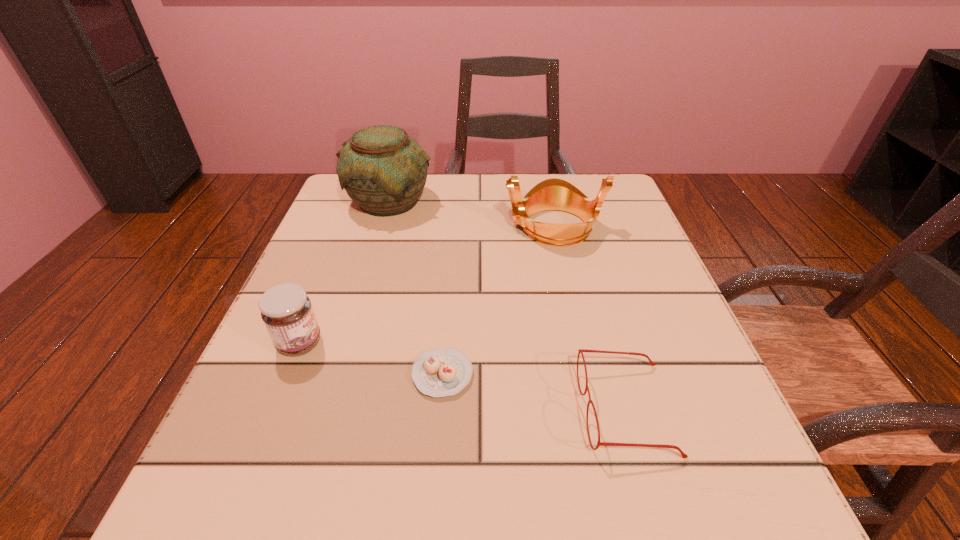
Locate an element on the screen. This screenshot has height=540, width=960. vacant space located 0.180m on the front label of the jam is located at coordinates (430, 343).

Where is `blank space located on the face of the spectacles`? The height and width of the screenshot is (540, 960). blank space located on the face of the spectacles is located at coordinates (334, 409).

Identify the location of vacant space located on the face of the spectacles. This screenshot has height=540, width=960. (355, 409).

At what (x,y) coordinates should I click in order to perform the action: click on free space located on the face of the spectacles. Please return your answer as a coordinate pair (x, y). Looking at the image, I should click on (321, 409).

You are a GUI agent. You are given a task and a screenshot of the screen. Output one action in this format:
    pyautogui.click(x=<x>, y=<y>)
    Task: Click on the blank space located 0.110m on the back of the cupcake
    The width and height of the screenshot is (960, 540).
    Given the screenshot: What is the action you would take?
    pyautogui.click(x=448, y=303)

I want to click on pottery at the far edge, so (383, 170).

Where is `tiara that is at the far edge`? tiara that is at the far edge is located at coordinates (552, 194).

You are a GUI agent. You are given a task and a screenshot of the screen. Output one action in this format:
    pyautogui.click(x=<x>, y=<y>)
    Task: Click on the object that is at the near edge
    
    Given the screenshot: What is the action you would take?
    pyautogui.click(x=581, y=351)

At what (x,y) coordinates should I click in order to perform the action: click on pottery that is positioned at the left edge. Please return your answer as a coordinate pair (x, y). Looking at the image, I should click on click(x=383, y=170).

At what (x,y) coordinates should I click in order to perform the action: click on jam that is at the left edge. Please return your answer as a coordinate pair (x, y). The height and width of the screenshot is (540, 960). Looking at the image, I should click on (286, 310).